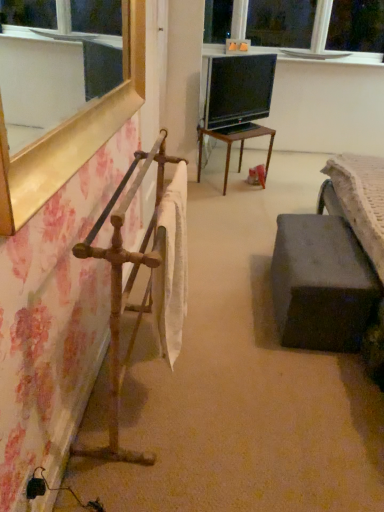
Question: Does wooden table at center have a greater width compared to black glossy tv at center?

Choices:
 (A) no
 (B) yes

Answer: (B)

Question: Is wooden table at center surrounding black glossy tv at center?

Choices:
 (A) yes
 (B) no

Answer: (B)

Question: Is wooden table at center positioned before black glossy tv at center?

Choices:
 (A) no
 (B) yes

Answer: (A)

Question: From a real-world perspective, does wooden table at center stand above black glossy tv at center?

Choices:
 (A) yes
 (B) no

Answer: (B)

Question: Can we say wooden table at center lies outside black glossy tv at center?

Choices:
 (A) yes
 (B) no

Answer: (A)

Question: Does wooden table at center have a smaller size compared to black glossy tv at center?

Choices:
 (A) yes
 (B) no

Answer: (B)

Question: Would you say black glossy tv at center is a long distance from white glossy window sill at upper center?

Choices:
 (A) yes
 (B) no

Answer: (A)

Question: Does black glossy tv at center have a greater height compared to white glossy window sill at upper center?

Choices:
 (A) yes
 (B) no

Answer: (A)

Question: Could you tell me if black glossy tv at center is turned towards white glossy window sill at upper center?

Choices:
 (A) no
 (B) yes

Answer: (A)

Question: From a real-world perspective, is black glossy tv at center beneath white glossy window sill at upper center?

Choices:
 (A) yes
 (B) no

Answer: (A)

Question: Is black glossy tv at center thinner than white glossy window sill at upper center?

Choices:
 (A) yes
 (B) no

Answer: (A)

Question: From the image's perspective, is black glossy tv at center located above white glossy window sill at upper center?

Choices:
 (A) yes
 (B) no

Answer: (B)

Question: From the image's perspective, would you say black glossy tv at center is shown under wooden table at center?

Choices:
 (A) no
 (B) yes

Answer: (A)